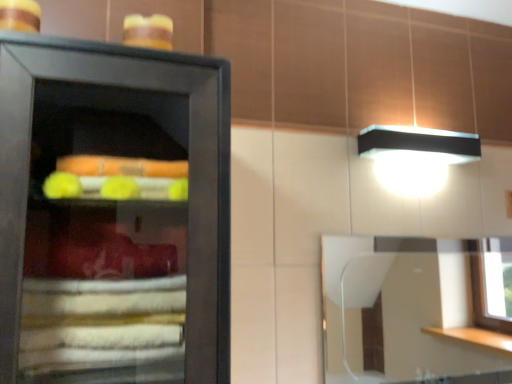
Question: Is clear glass mirror at upper right situated inside yellow frosted cake at upper left or outside?

Choices:
 (A) inside
 (B) outside

Answer: (B)

Question: In terms of width, does clear glass mirror at upper right look wider or thinner when compared to yellow frosted cake at upper left?

Choices:
 (A) thin
 (B) wide

Answer: (A)

Question: From a real-world perspective, is clear glass mirror at upper right positioned above or below yellow frosted cake at upper left?

Choices:
 (A) above
 (B) below

Answer: (B)

Question: Is yellow frosted cake at upper left inside or outside of clear glass mirror at upper right?

Choices:
 (A) inside
 (B) outside

Answer: (B)

Question: From the image's perspective, relative to clear glass mirror at upper right, is yellow frosted cake at upper left above or below?

Choices:
 (A) below
 (B) above

Answer: (B)

Question: From a real-world perspective, is yellow frosted cake at upper left positioned above or below clear glass mirror at upper right?

Choices:
 (A) above
 (B) below

Answer: (A)

Question: Is yellow frosted cake at upper left in front of or behind clear glass mirror at upper right in the image?

Choices:
 (A) behind
 (B) front

Answer: (B)